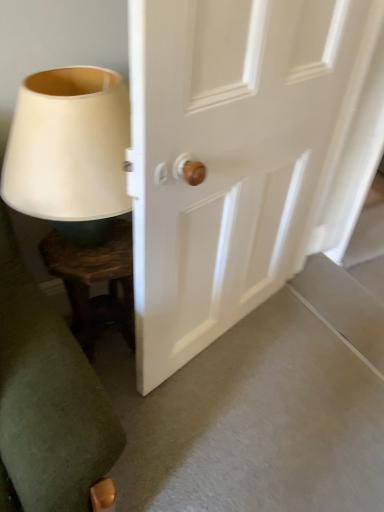
Question: Based on their positions, is white wooden door at center located to the left or right of matte white lampshade at left?

Choices:
 (A) left
 (B) right

Answer: (B)

Question: From a real-world perspective, is white wooden door at center physically located above or below matte white lampshade at left?

Choices:
 (A) above
 (B) below

Answer: (B)

Question: Which object is positioned farthest from the dark wood side table at lower left?

Choices:
 (A) matte white lampshade at left
 (B) white wooden door at center

Answer: (B)

Question: Which object is the farthest from the white wooden door at center?

Choices:
 (A) dark wood side table at lower left
 (B) matte white lampshade at left

Answer: (A)